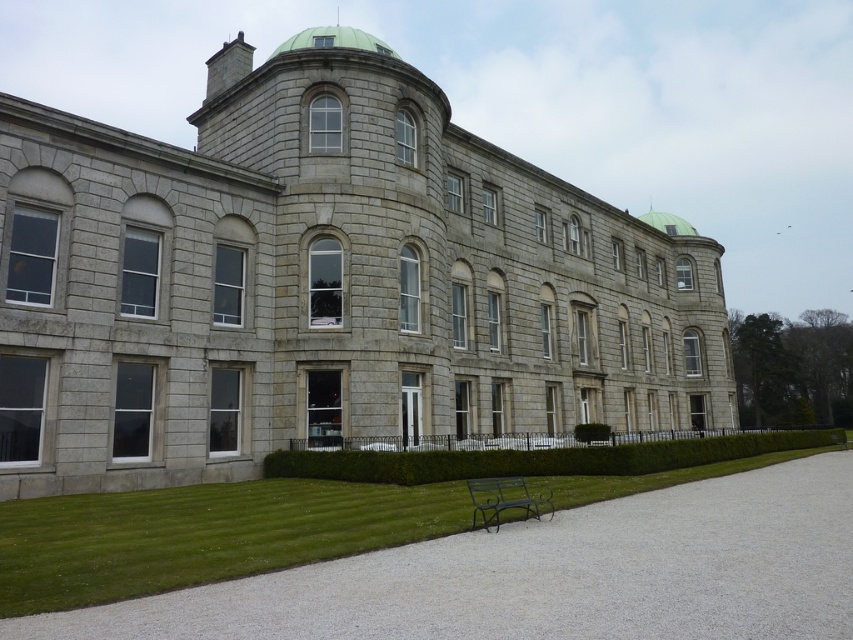
You are planning to place a picnic blanket on the green grass at lower left and the green leafy hedge at center. Which area would allow you to spread the blanket more comfortably?

The green leafy hedge at center has a larger size compared to the green grass at lower left, so spreading the picnic blanket would be more comfortable there.

You are a gardener who needs to mow the lawn. You see the green grass at lower left and the green leafy hedge at center. Which area requires mowing first based on their current heights?

The green grass at lower left needs to be mowed first because it is shorter than the green leafy hedge at center, indicating it may need maintenance to maintain evenness.